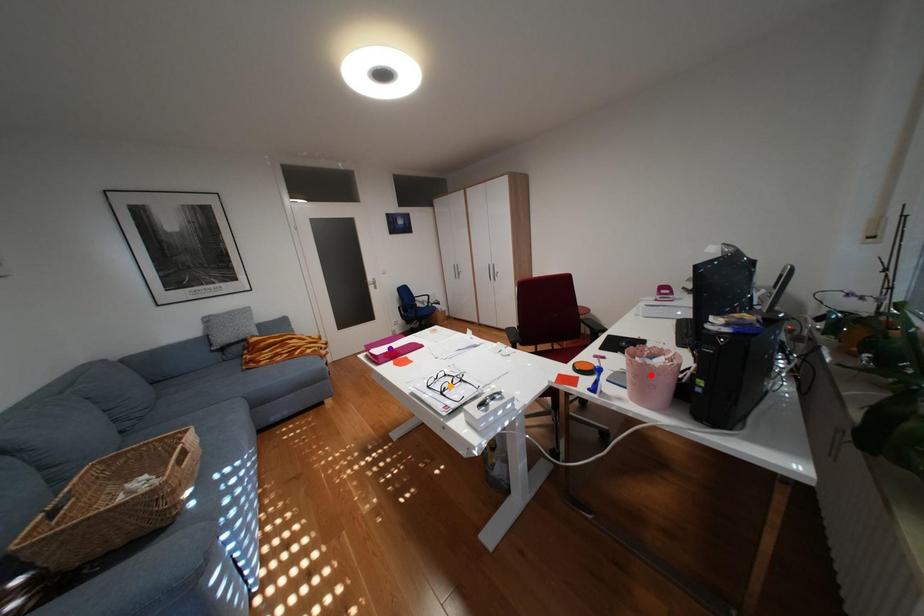
Order these from farthest to nearest:
purple point
red point
orange point

purple point → orange point → red point